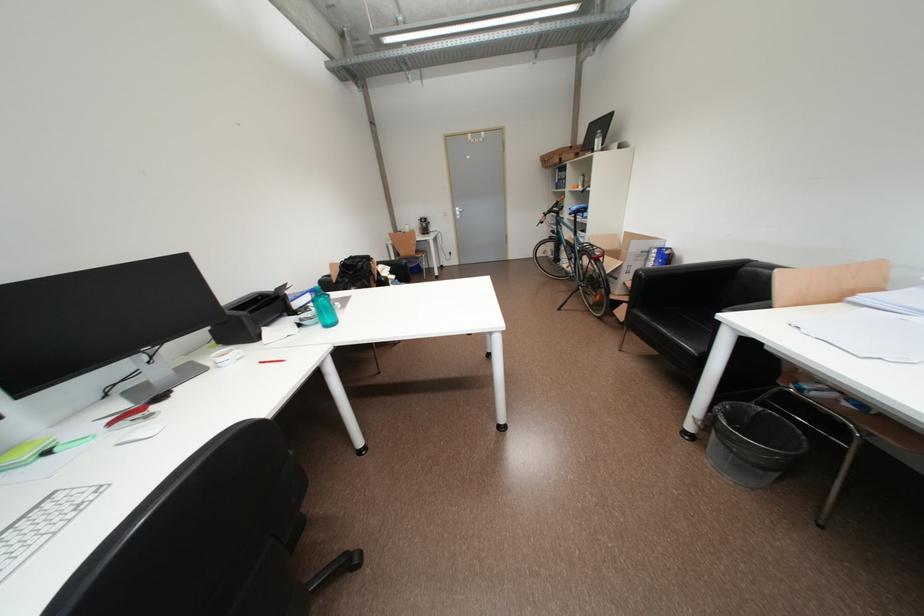
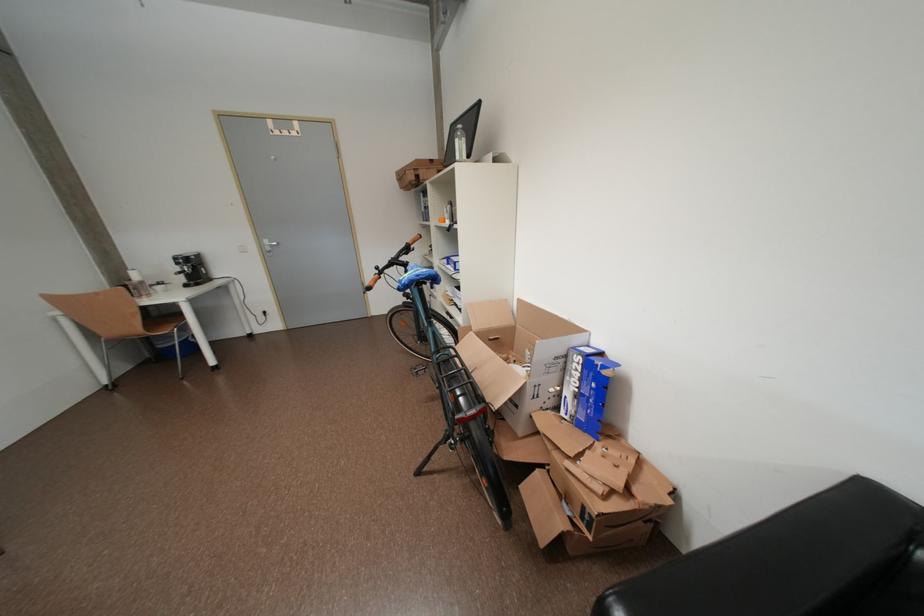
What movement of the cameraman would produce the second image?

The cameraman moved toward right, forward.